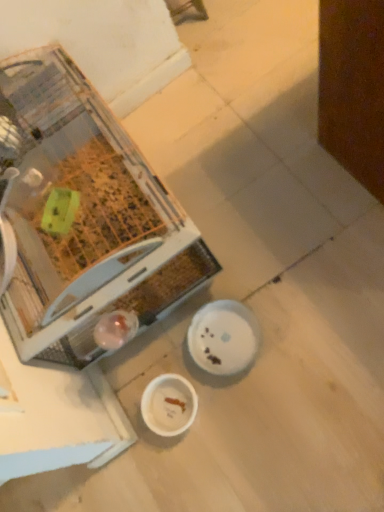
Locate an element on the screen. The width and height of the screenshot is (384, 512). free spot in front of clear plastic cage at left is located at coordinates (253, 377).